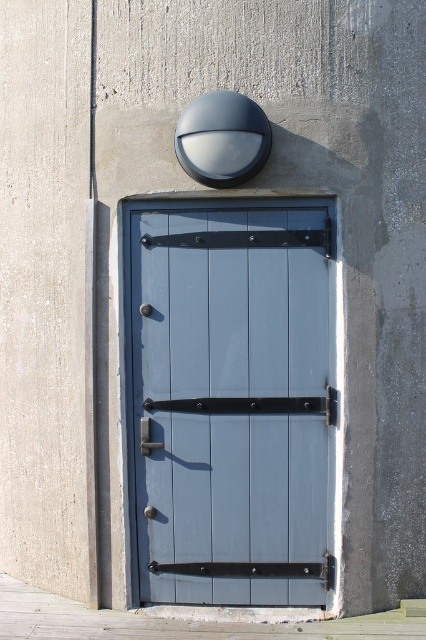
You are trying to open the door in the image. Which object, the matte wood door at center or the matte silver handle at center, should you interact with first?

The matte wood door at center is in front of the matte silver handle at center, so you should interact with the matte silver handle at center first to open the door.

You are trying to open the door in the image. Based on the scene, where should you push or pull to open the matte wood door at center using the matte silver handle at center?

The matte wood door at center is above the matte silver handle at center, so you should push down on the matte silver handle at center to open the door.